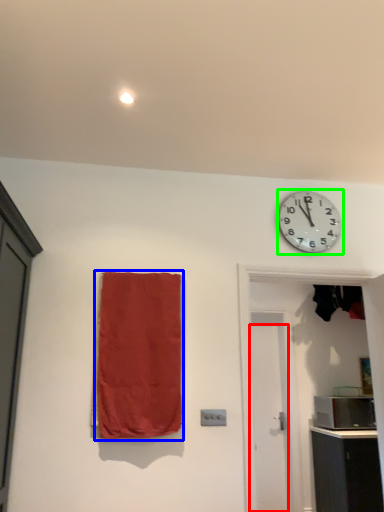
Question: Estimate the real-world distances between objects in this image. Which object is closer to door (highlighted by a red box), curtain (highlighted by a blue box) or wall clock (highlighted by a green box)?

Choices:
 (A) curtain
 (B) wall clock

Answer: (B)